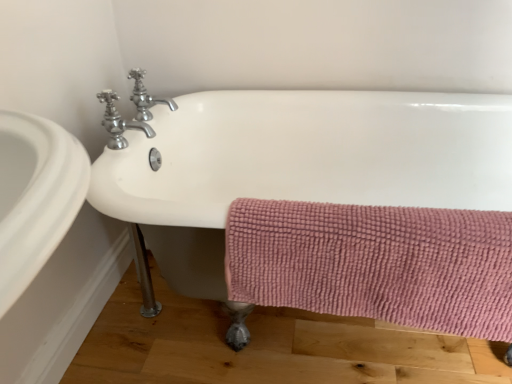
Question: Considering the relative sizes of white ceramic bathtub at center and polished chrome faucet at upper left, which is the 2th tap in front-to-back order, in the image provided, is white ceramic bathtub at center wider than polished chrome faucet at upper left, which is the 2th tap in front-to-back order,?

Choices:
 (A) no
 (B) yes

Answer: (B)

Question: Is white ceramic bathtub at center closer to the viewer compared to polished chrome faucet at upper left, which is the 2th tap in front-to-back order?

Choices:
 (A) yes
 (B) no

Answer: (A)

Question: Is white ceramic bathtub at center far away from polished chrome faucet at upper left, which is the 2th tap in front-to-back order?

Choices:
 (A) no
 (B) yes

Answer: (A)

Question: Does white ceramic bathtub at center contain polished chrome faucet at upper left, positioned as the 1th tap in back-to-front order?

Choices:
 (A) yes
 (B) no

Answer: (B)

Question: Can you confirm if white ceramic bathtub at center is bigger than polished chrome faucet at upper left, positioned as the 1th tap in back-to-front order?

Choices:
 (A) no
 (B) yes

Answer: (B)

Question: Is pink textured towel at lower right to the left or to the right of polished chrome faucet at upper left, positioned as the 1th tap in back-to-front order, in the image?

Choices:
 (A) left
 (B) right

Answer: (B)

Question: In terms of width, does pink textured towel at lower right look wider or thinner when compared to polished chrome faucet at upper left, which is the 2th tap in front-to-back order?

Choices:
 (A) thin
 (B) wide

Answer: (A)

Question: From a real-world perspective, is pink textured towel at lower right physically located above or below polished chrome faucet at upper left, positioned as the 1th tap in back-to-front order?

Choices:
 (A) above
 (B) below

Answer: (B)

Question: Is pink textured towel at lower right bigger or smaller than polished chrome faucet at upper left, which is the 2th tap in front-to-back order?

Choices:
 (A) big
 (B) small

Answer: (A)

Question: Looking at the image, does polished chrome faucet at upper left, which is the 2th tap in front-to-back order, seem bigger or smaller compared to pink textured towel at lower right?

Choices:
 (A) big
 (B) small

Answer: (B)

Question: Based on their positions, is polished chrome faucet at upper left, positioned as the 1th tap in back-to-front order, located to the left or right of pink textured towel at lower right?

Choices:
 (A) right
 (B) left

Answer: (B)

Question: Considering their positions, is polished chrome faucet at upper left, which is the 2th tap in front-to-back order, located in front of or behind pink textured towel at lower right?

Choices:
 (A) behind
 (B) front

Answer: (A)

Question: From the image's perspective, is polished chrome faucet at upper left, which is the 2th tap in front-to-back order, above or below pink textured towel at lower right?

Choices:
 (A) below
 (B) above

Answer: (B)

Question: Based on their sizes in the image, would you say pink textured towel at lower right is bigger or smaller than white ceramic bathtub at center?

Choices:
 (A) big
 (B) small

Answer: (B)

Question: Is pink textured towel at lower right wider or thinner than white ceramic bathtub at center?

Choices:
 (A) wide
 (B) thin

Answer: (B)